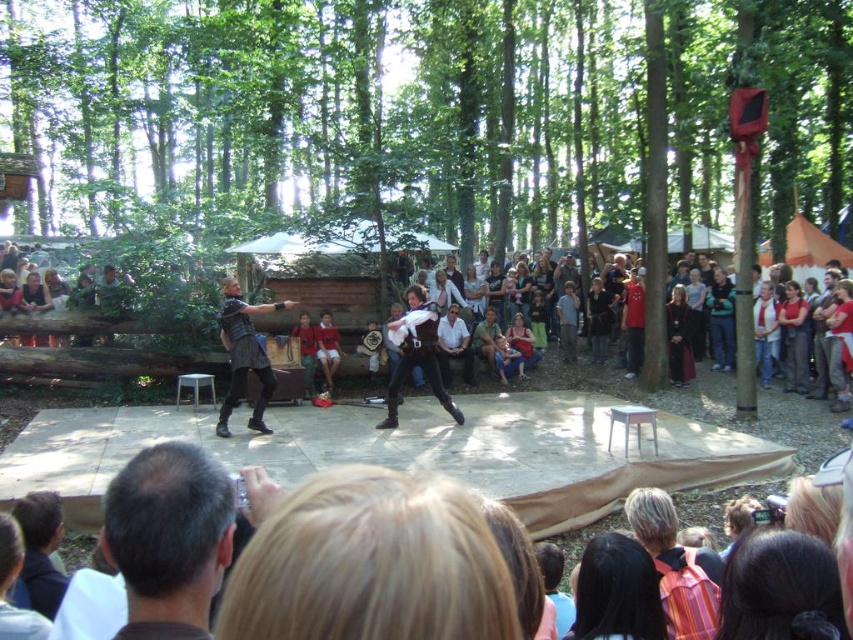
You are a photographer at the back of the audience. You want to capture a photo that includes both the light blue shirt at center and the denim jacket at center. Which object should you focus on first to ensure both are in frame?

The light blue shirt at center is narrower than the denim jacket at center, so you should focus on the denim jacket at center first to ensure both fit within the frame.